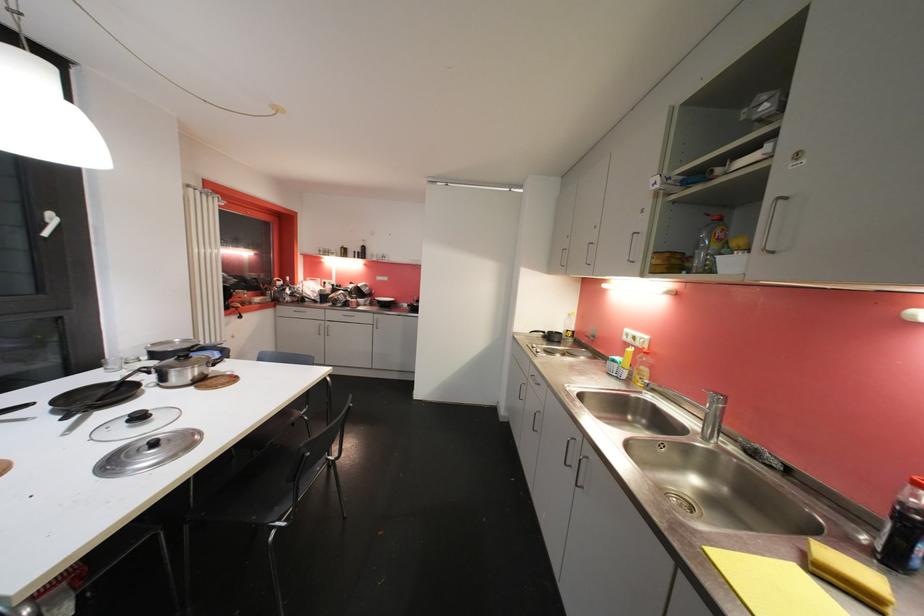
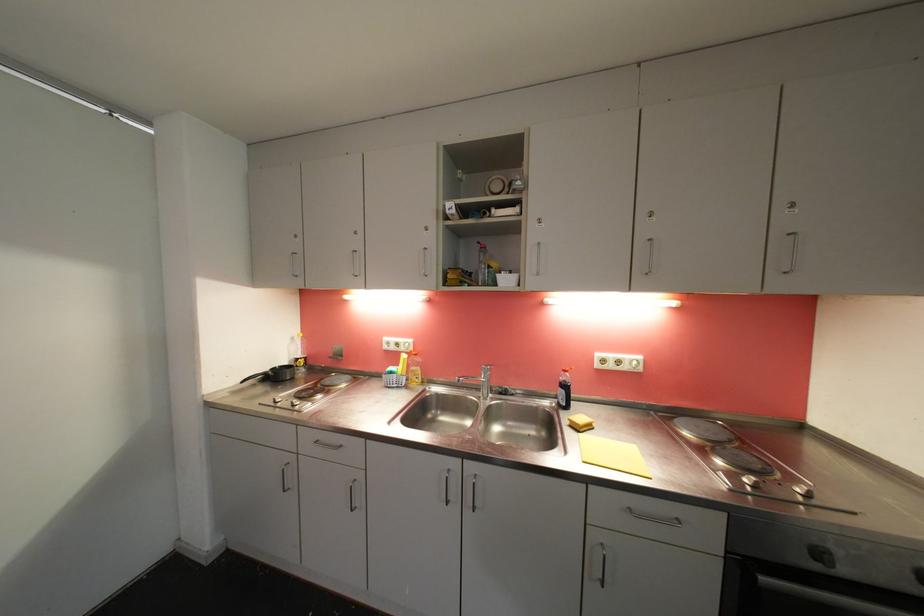
Question: The camera is either moving clockwise (left) or counter-clockwise (right) around the object. The first image is from the beginning of the video and the second image is from the end. Is the camera moving left or right when shooting the video?

Choices:
 (A) Left
 (B) Right

Answer: (A)